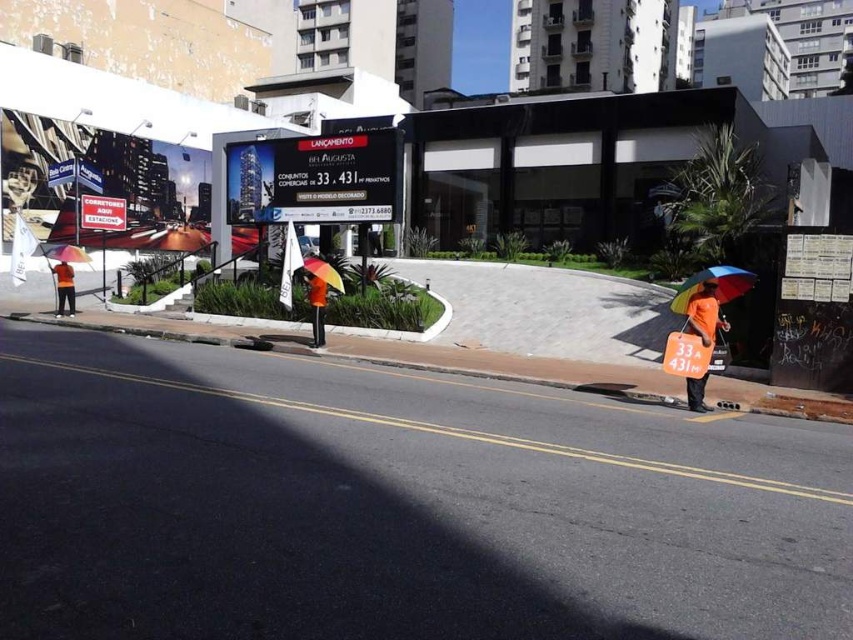
Question: Which of the following is the closest to the observer?

Choices:
 (A) (312, 260)
 (B) (685, 330)
 (C) (62, 260)

Answer: (B)

Question: Which object appears farthest from the camera in this image?

Choices:
 (A) orange fabric umbrella at left
 (B) rainbow fabric umbrella at center
 (C) rainbow fabric umbrella at right

Answer: (A)

Question: Based on their relative distances, which object is farther from the matte black signboard at center?

Choices:
 (A) orange reflective vest at center
 (B) orange fabric umbrella at left
 (C) white paper sign at left

Answer: (C)

Question: Can you confirm if rainbow fabric umbrella at center is smaller than pink fabric umbrella at left?

Choices:
 (A) no
 (B) yes

Answer: (B)

Question: Where is matte black signboard at center located in relation to rainbow fabric umbrella at right in the image?

Choices:
 (A) right
 (B) left

Answer: (B)

Question: Is matte black signboard at center thinner than orange fabric umbrella at left?

Choices:
 (A) no
 (B) yes

Answer: (B)